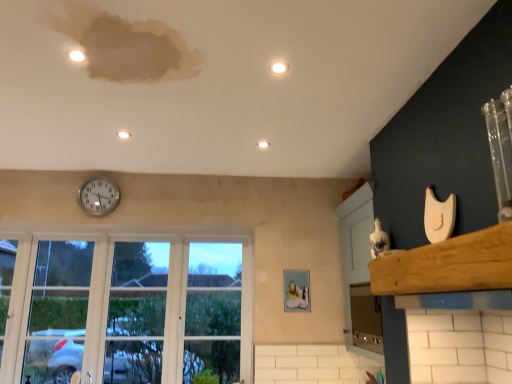
Question: Considering their positions, is wooden at upper right located in front of or behind matte white light at upper center, positioned as the 2th light in top-to-bottom order?

Choices:
 (A) front
 (B) behind

Answer: (A)

Question: Is wooden at upper right to the left or to the right of matte white light at upper center, marked as the 1th light in a left-to-right arrangement, in the image?

Choices:
 (A) right
 (B) left

Answer: (A)

Question: Which is farther from the white glossy light at upper center, which is the 1th light in right-to-left order?

Choices:
 (A) silver metallic clock at upper center
 (B) matte white light at upper center, marked as the 1th light in a left-to-right arrangement
 (C) clear glass window at lower left
 (D) satin silver oven at lower right
 (E) white glossy light at center, which appears as the 2th light when viewed from the left

Answer: (C)

Question: Which is farther from the matte white light at upper center, acting as the third light starting from the right?

Choices:
 (A) silver metallic clock at upper center
 (B) clear glass window at lower left
 (C) white glossy light at upper center, the 3th light in the bottom-to-top sequence
 (D) satin silver oven at lower right
 (E) white glossy light at center, the 3th light in the top-to-bottom sequence

Answer: (D)